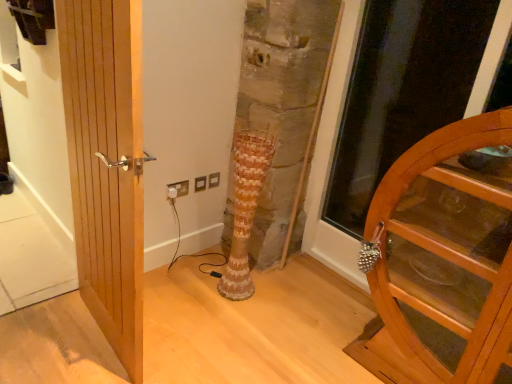
Find the location of `free location to the right of brown textured vase at center`. free location to the right of brown textured vase at center is located at coordinates (273, 297).